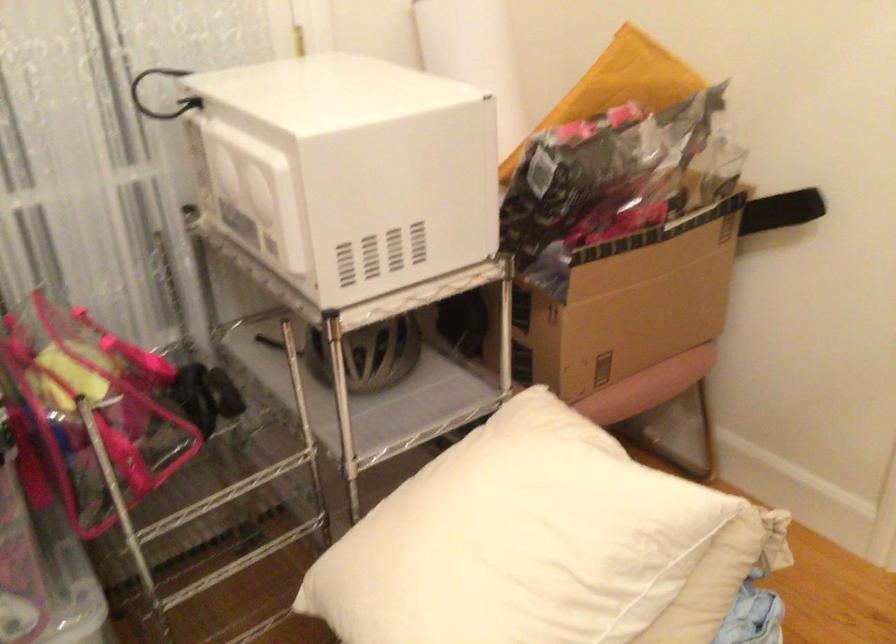
Identify the location of bicycle helmet. (375, 355).